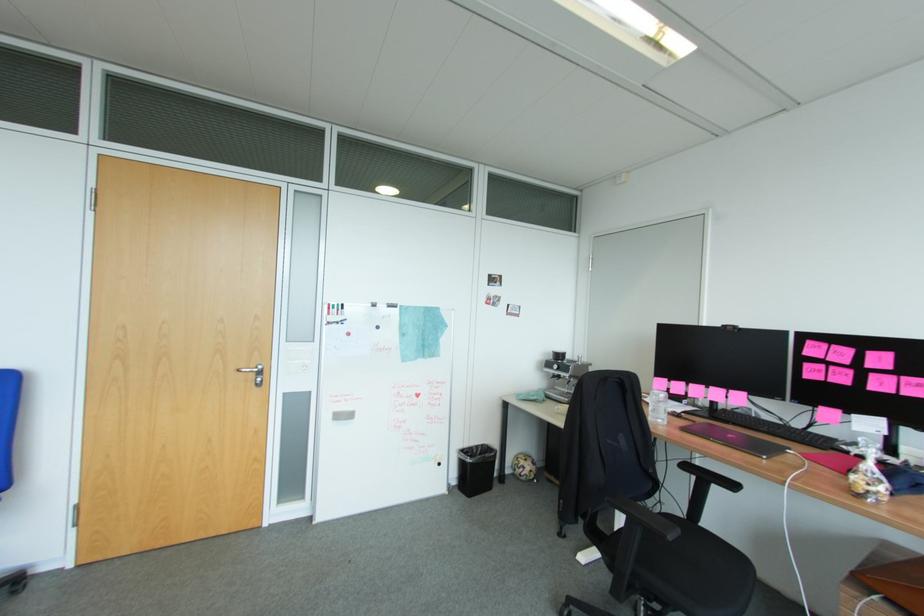
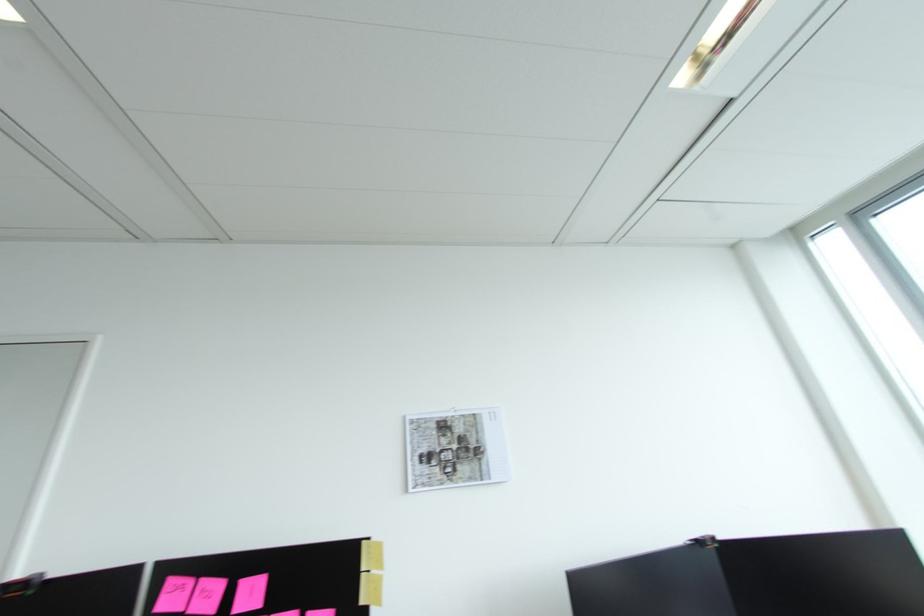
The point at (894,368) is marked in the first image. Where is the corresponding point in the second image?

(262, 605)